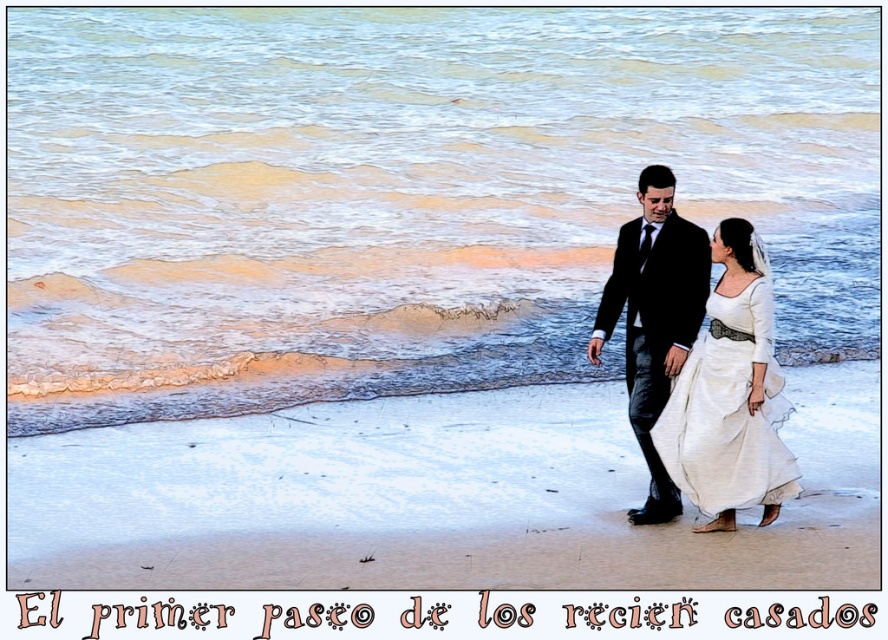
You are a photographer taking a photo of the white satin dress at lower right and the black satin suit at center. Which one appears larger in the photo?

The white satin dress at lower right appears larger in the photo because it is closer to the viewer than the black satin suit at center.

You are a photographer trying to capture the perfect shot of the white satin dress at lower right. According to the coordinates provided, where exactly should you position your camera to ensure the dress is centered in the frame?

To center the white satin dress at lower right in your frame, position your camera so that it aligns with the coordinates point (728, 410), as this is the 2D location of the dress.

You are a photographer capturing a beach wedding photo. You notice the white satin dress at lower right and the black satin suit at center. To ensure both subjects are in focus, you need to adjust your camera settings. Given the distance between them, can you determine if they are within the depth of field range of your lens? Assume your lens has a maximum depth of field of 15 inches at the current aperture setting.

The white satin dress at lower right is 15.13 inches away from the black satin suit at center. Since the distance exceeds the lens maximum depth of field of 15 inches, the subjects may not both be in focus simultaneously.